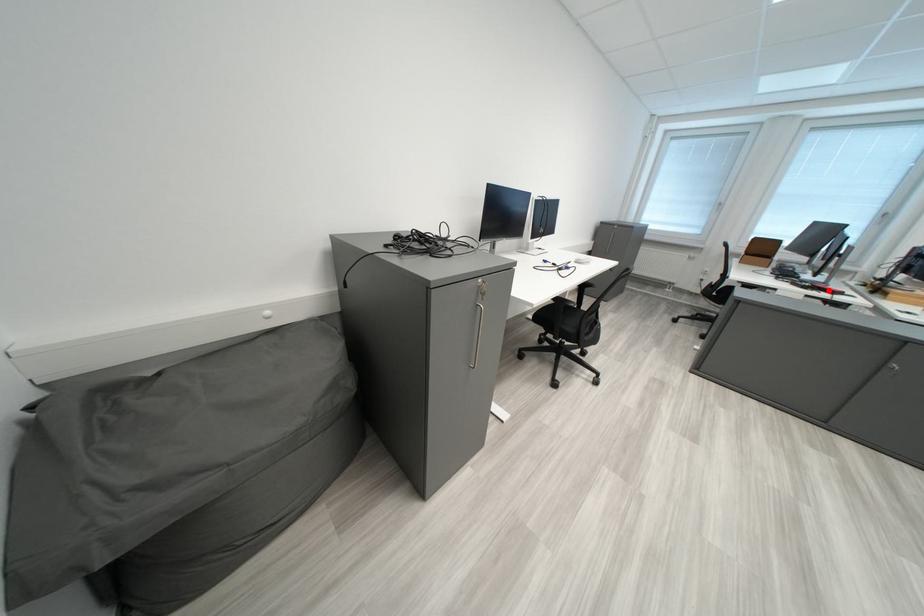
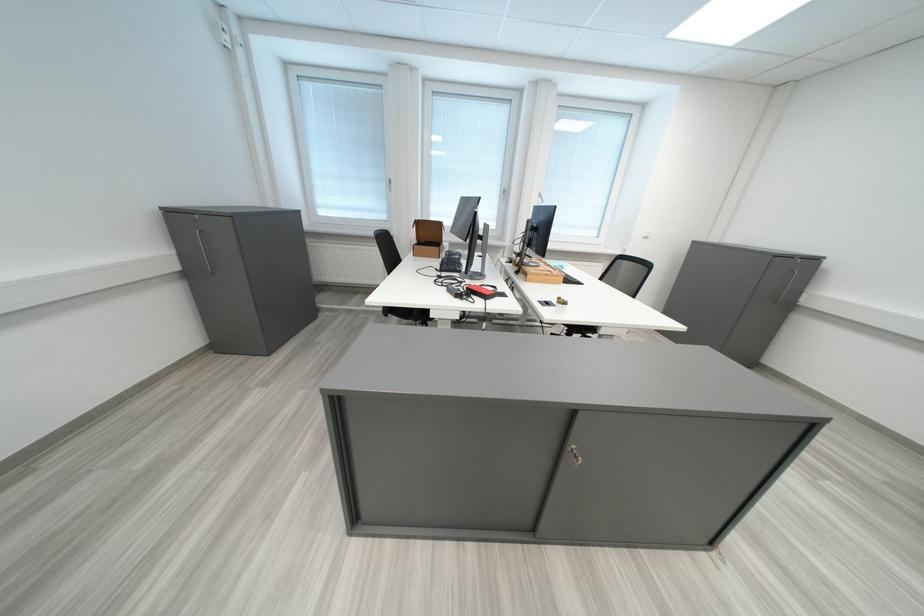
Find the pixel in the second image that matches the highlighted location in the first image.

(483, 294)